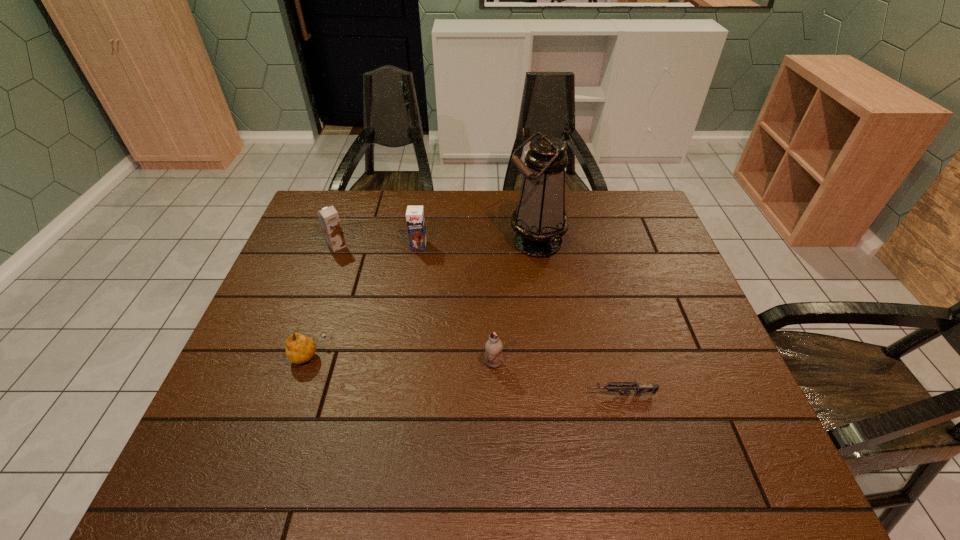
Image resolution: width=960 pixels, height=540 pixels. What are the coordinates of `vacant area at the left edge` in the screenshot? It's located at (228, 409).

You are a GUI agent. You are given a task and a screenshot of the screen. Output one action in this format:
    pyautogui.click(x=<x>, y=<y>)
    Task: Click on the vacant space at the right edge of the desktop
    This screenshot has width=960, height=540.
    Given the screenshot: What is the action you would take?
    pyautogui.click(x=671, y=326)

At what (x,y) coordinates should I click in order to perform the action: click on free space at the near left corner of the desktop. Please return your answer as a coordinate pair (x, y). Looking at the image, I should click on (245, 441).

This screenshot has width=960, height=540. What are the coordinates of `vacant space at the far right corner of the desktop` in the screenshot? It's located at (626, 217).

I want to click on vacant space at the near right corner of the desktop, so click(691, 441).

In order to click on empty space between the nearest object and the fifth tallest object in this screenshot , I will do `click(464, 375)`.

This screenshot has width=960, height=540. I want to click on vacant space that's between the oil lamp and the leftmost chocolate milk, so click(x=437, y=244).

Where is `vacant region between the oil lamp and the leftmost chocolate milk`? This screenshot has width=960, height=540. vacant region between the oil lamp and the leftmost chocolate milk is located at coordinates (437, 244).

Image resolution: width=960 pixels, height=540 pixels. Find the location of `free space between the leftmost chocolate milk and the nearest chocolate milk`. free space between the leftmost chocolate milk and the nearest chocolate milk is located at coordinates (415, 305).

Find the location of `vacant region between the fifth tallest object and the second chocolate milk from left to right`. vacant region between the fifth tallest object and the second chocolate milk from left to right is located at coordinates (364, 300).